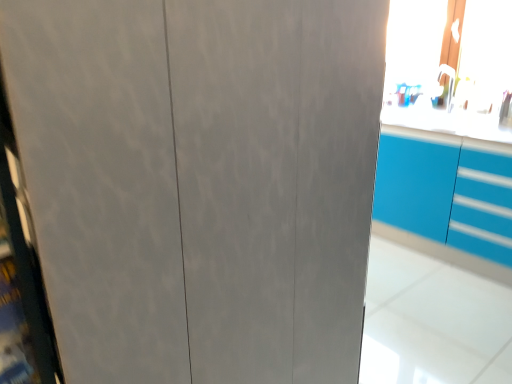
This screenshot has width=512, height=384. What do you see at coordinates (446, 192) in the screenshot?
I see `blue glossy cabinet at upper right` at bounding box center [446, 192].

Where is `blue glossy cabinet at upper right`? blue glossy cabinet at upper right is located at coordinates (446, 192).

This screenshot has height=384, width=512. Describe the element at coordinates (450, 66) in the screenshot. I see `transparent plastic window screen at upper right` at that location.

Identify the location of transparent plastic window screen at upper right. The height and width of the screenshot is (384, 512). (450, 66).

The image size is (512, 384). I want to click on blue glossy cabinet at upper right, so click(x=446, y=192).

Is transparent plastic window screen at upper right at the left side of blue glossy cabinet at upper right?

In fact, transparent plastic window screen at upper right is to the right of blue glossy cabinet at upper right.

Considering the positions of objects transparent plastic window screen at upper right and blue glossy cabinet at upper right in the image provided, who is in front, transparent plastic window screen at upper right or blue glossy cabinet at upper right?

blue glossy cabinet at upper right.

Which is further, (412, 3) or (396, 201)?

The point (412, 3) is farther from the camera.

From the image's perspective, who appears lower, transparent plastic window screen at upper right or blue glossy cabinet at upper right?

blue glossy cabinet at upper right, from the image's perspective.

From a real-world perspective, between transparent plastic window screen at upper right and blue glossy cabinet at upper right, who is vertically lower?

In real-world perspective, blue glossy cabinet at upper right is lower.

Consider the image. Does transparent plastic window screen at upper right have a greater width compared to blue glossy cabinet at upper right?

In fact, transparent plastic window screen at upper right might be narrower than blue glossy cabinet at upper right.

Considering the sizes of objects transparent plastic window screen at upper right and blue glossy cabinet at upper right in the image provided, who is shorter, transparent plastic window screen at upper right or blue glossy cabinet at upper right?

transparent plastic window screen at upper right is shorter.

Considering the relative sizes of transparent plastic window screen at upper right and blue glossy cabinet at upper right in the image provided, is transparent plastic window screen at upper right bigger than blue glossy cabinet at upper right?

No.

Is transparent plastic window screen at upper right completely or partially outside of blue glossy cabinet at upper right?

Yes, transparent plastic window screen at upper right is outside of blue glossy cabinet at upper right.

Is transparent plastic window screen at upper right positioned far away from blue glossy cabinet at upper right?

No.

Is transparent plastic window screen at upper right turned away from blue glossy cabinet at upper right?

transparent plastic window screen at upper right does not have its back to blue glossy cabinet at upper right.

How different are the orientations of transparent plastic window screen at upper right and blue glossy cabinet at upper right in degrees?

They differ by 0.835 degrees in their facing directions.

The height and width of the screenshot is (384, 512). I want to click on cabinetry on the left of transparent plastic window screen at upper right, so click(x=446, y=192).

Considering the positions of objects blue glossy cabinet at upper right and transparent plastic window screen at upper right in the image provided, who is more to the left, blue glossy cabinet at upper right or transparent plastic window screen at upper right?

From the viewer's perspective, blue glossy cabinet at upper right appears more on the left side.

Considering the positions of objects blue glossy cabinet at upper right and transparent plastic window screen at upper right in the image provided, who is behind, blue glossy cabinet at upper right or transparent plastic window screen at upper right?

transparent plastic window screen at upper right is further away from the camera.

Is point (497, 232) positioned behind point (511, 59)?

No, it is not.

From the image's perspective, does blue glossy cabinet at upper right appear higher than transparent plastic window screen at upper right?

No, from the image's perspective, blue glossy cabinet at upper right is not over transparent plastic window screen at upper right.

From a real-world perspective, is blue glossy cabinet at upper right physically located above or below transparent plastic window screen at upper right?

blue glossy cabinet at upper right is situated lower than transparent plastic window screen at upper right in the real world.

Considering the sizes of objects blue glossy cabinet at upper right and transparent plastic window screen at upper right in the image provided, who is thinner, blue glossy cabinet at upper right or transparent plastic window screen at upper right?

With smaller width is transparent plastic window screen at upper right.

From the picture: Which of these two, blue glossy cabinet at upper right or transparent plastic window screen at upper right, stands taller?

blue glossy cabinet at upper right is taller.

Who is bigger, blue glossy cabinet at upper right or transparent plastic window screen at upper right?

With larger size is blue glossy cabinet at upper right.

Looking at this image, does blue glossy cabinet at upper right contain transparent plastic window screen at upper right?

No.

Is blue glossy cabinet at upper right next to transparent plastic window screen at upper right and touching it?

blue glossy cabinet at upper right and transparent plastic window screen at upper right are not in contact.

Could you tell me if blue glossy cabinet at upper right is facing transparent plastic window screen at upper right?

No.

Measure the distance between blue glossy cabinet at upper right and transparent plastic window screen at upper right.

They are 58.88 centimeters apart.

Where is `cabinetry below the transparent plastic window screen at upper right (from a real-world perspective)`? cabinetry below the transparent plastic window screen at upper right (from a real-world perspective) is located at coordinates (446, 192).

Where is `window screen above the blue glossy cabinet at upper right (from the image's perspective)`? This screenshot has width=512, height=384. window screen above the blue glossy cabinet at upper right (from the image's perspective) is located at coordinates (450, 66).

Find the location of a particular element. The width and height of the screenshot is (512, 384). window screen to the right of blue glossy cabinet at upper right is located at coordinates (450, 66).